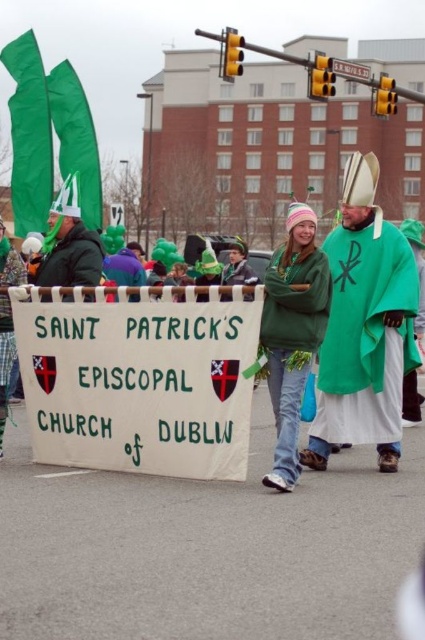
You are a photographer at the parade. You want to take a photo of the white paper banner at center and the green fabric cape at center so that both are visible in the frame. Considering their sizes, which object should you focus on to ensure both fit in the photo?

The white paper banner at center is much taller than the green fabric cape at center. To ensure both fit in the photo, focus on the white paper banner at center since it is the larger object and adjusting the frame to include it will naturally accommodate the smaller green fabric cape at center.

You are a photographer at the St. Patrick Episcopal Church of Dublin parade. You want to take a photo of the banner and the two people holding it. The banner is held by two people at the coordinates point (235, 433) and point (390, 259). Which person should you focus on first to ensure they are in the foreground of your photo?

Point (235, 433) is in front of point (390, 259), so you should focus on the person at point (235, 433) first to ensure they are in the foreground of your photo.

You are a photographer trying to capture the banner and the participants in the St. Patrick Day parade. You notice two green items at the center of the image. Which one is taller, the green fabric cape at center or the green fleece sweater at center?

The green fabric cape at center is taller than the green fleece sweater at center.